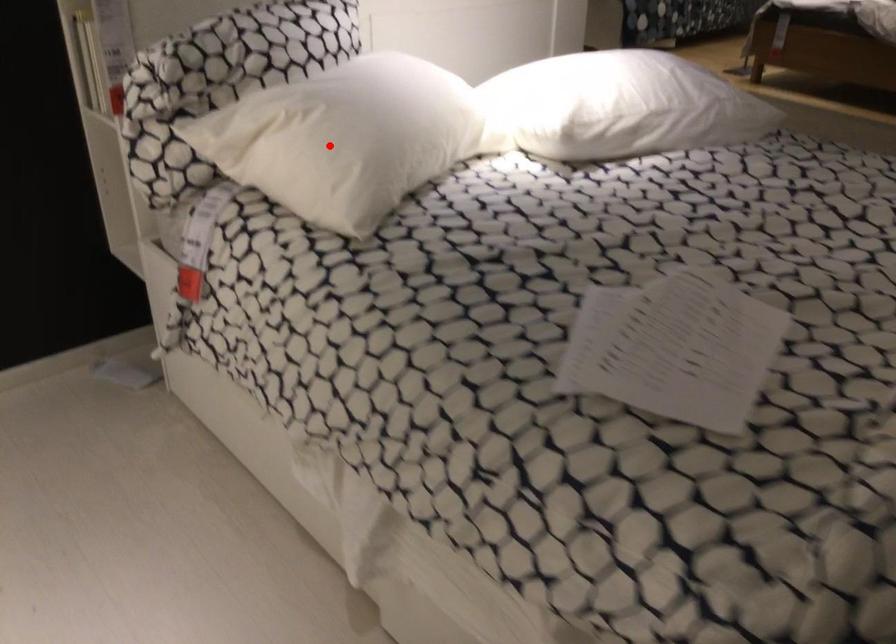
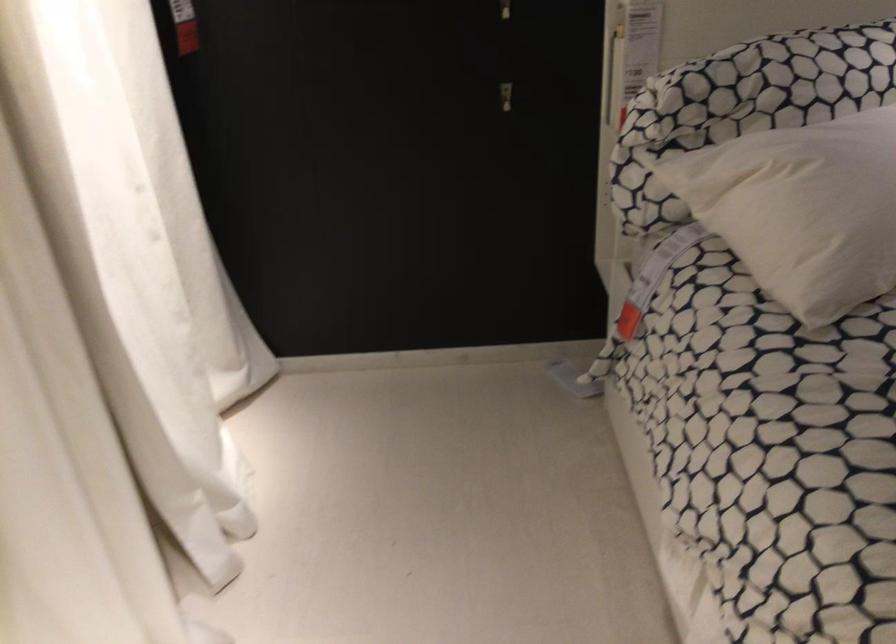
Question: I am providing you with two images of the same scene from different viewpoints. A red point is shown in image1. For the corresponding object point in image2, is it positioned nearer or farther from the camera?

Choices:
 (A) Nearer
 (B) Farther

Answer: (A)